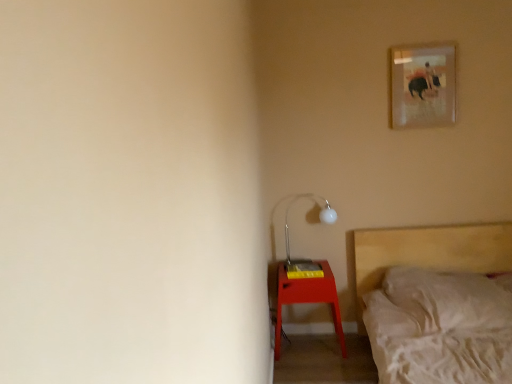
Question: Does matte glass picture frame at upper right have a lesser height compared to matte white metal table lamp at lower right?

Choices:
 (A) yes
 (B) no

Answer: (B)

Question: Is matte glass picture frame at upper right completely or partially outside of matte white metal table lamp at lower right?

Choices:
 (A) no
 (B) yes

Answer: (B)

Question: Does matte glass picture frame at upper right appear on the left side of matte white metal table lamp at lower right?

Choices:
 (A) no
 (B) yes

Answer: (A)

Question: Does matte glass picture frame at upper right have a larger size compared to matte white metal table lamp at lower right?

Choices:
 (A) yes
 (B) no

Answer: (B)

Question: Is matte glass picture frame at upper right smaller than matte white metal table lamp at lower right?

Choices:
 (A) yes
 (B) no

Answer: (A)

Question: From a real-world perspective, is matte glass picture frame at upper right physically below matte white metal table lamp at lower right?

Choices:
 (A) yes
 (B) no

Answer: (B)

Question: Is matte white metal table lamp at lower right to the right of wooden bed at lower right from the viewer's perspective?

Choices:
 (A) no
 (B) yes

Answer: (A)

Question: From the image's perspective, is matte white metal table lamp at lower right on wooden bed at lower right?

Choices:
 (A) yes
 (B) no

Answer: (A)

Question: Are matte white metal table lamp at lower right and wooden bed at lower right located far from each other?

Choices:
 (A) no
 (B) yes

Answer: (A)

Question: Is matte white metal table lamp at lower right bigger than wooden bed at lower right?

Choices:
 (A) yes
 (B) no

Answer: (B)

Question: Does matte white metal table lamp at lower right have a smaller size compared to wooden bed at lower right?

Choices:
 (A) yes
 (B) no

Answer: (A)

Question: Considering the relative sizes of matte white metal table lamp at lower right and wooden bed at lower right in the image provided, is matte white metal table lamp at lower right taller than wooden bed at lower right?

Choices:
 (A) no
 (B) yes

Answer: (A)

Question: Does matte red nightstand at lower right have a greater height compared to matte white metal table lamp at lower right?

Choices:
 (A) yes
 (B) no

Answer: (A)